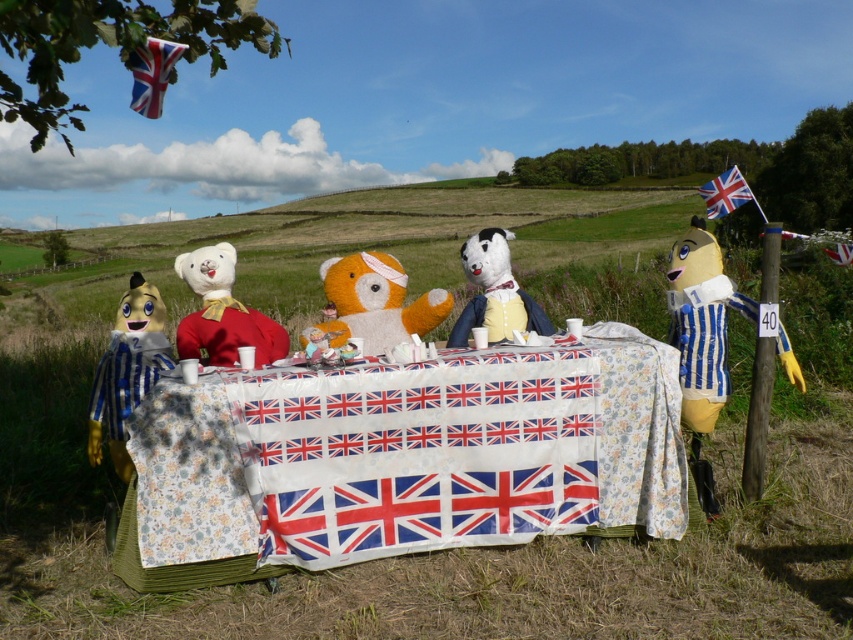
Between point (408, 326) and point (120, 323), which one is positioned in front?

Point (408, 326) is in front.

Between point (345, 282) and point (90, 440), which one is positioned behind?

The point (345, 282) is behind.

Does point (419, 320) lie behind point (154, 372)?

Yes, point (419, 320) is behind point (154, 372).

Identify the location of fluffy orange teddy bear at center. The height and width of the screenshot is (640, 853). (373, 304).

Can you confirm if floral fabric table at center is thinner than fluffy orange teddy bear at center?

Incorrect, floral fabric table at center's width is not less than fluffy orange teddy bear at center's.

Measure the distance between point (380, 369) and camera.

Result: Point (380, 369) is 3.45 meters away from camera.

Who is more forward, (592, 484) or (337, 260)?

Positioned in front is point (592, 484).

Locate an element on the screen. The width and height of the screenshot is (853, 640). floral fabric table at center is located at coordinates (403, 458).

Consider the image. Can you confirm if fluffy orange teddy bear at center is thinner than velvet-like white dog at center?

A: No, fluffy orange teddy bear at center is not thinner than velvet-like white dog at center.

This screenshot has width=853, height=640. Describe the element at coordinates (373, 304) in the screenshot. I see `fluffy orange teddy bear at center` at that location.

Locate an element on the screen. This screenshot has width=853, height=640. fluffy orange teddy bear at center is located at coordinates (373, 304).